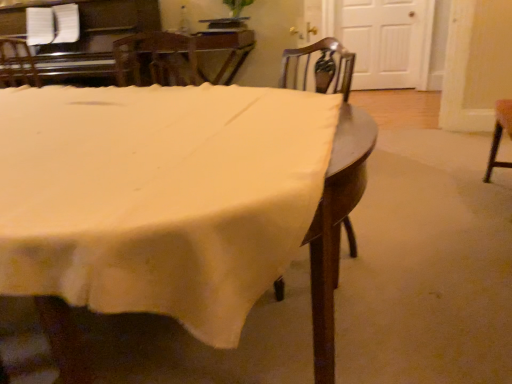
Where is `wooden at center`? wooden at center is located at coordinates (320, 65).

Describe the element at coordinates (320, 65) in the screenshot. I see `wooden at center` at that location.

Measure the distance between point (281, 294) and camera.

A distance of 1.61 meters exists between point (281, 294) and camera.

Describe the element at coordinates (178, 203) in the screenshot. I see `white fabric table at center` at that location.

In order to click on white fabric table at center in this screenshot , I will do coord(178,203).

The image size is (512, 384). I want to click on wooden at center, so click(320, 65).

Which is more to the left, wooden at center or white fabric table at center?

white fabric table at center.

Which is behind, wooden at center or white fabric table at center?

wooden at center is further away from the camera.

Does point (303, 89) come in front of point (44, 133)?

No, it is behind (44, 133).

From the image's perspective, which one is positioned higher, wooden at center or white fabric table at center?

From the image's view, wooden at center is above.

From a real-world perspective, is wooden at center physically located above or below white fabric table at center?

wooden at center is above white fabric table at center.

Considering the relative sizes of wooden at center and white fabric table at center in the image provided, is wooden at center wider than white fabric table at center?

No.

From the picture: Which of these two, wooden at center or white fabric table at center, stands shorter?

white fabric table at center is shorter.

Can you confirm if wooden at center is bigger than white fabric table at center?

Incorrect, wooden at center is not larger than white fabric table at center.

From the picture: Can white fabric table at center be found inside wooden at center?

No.

Is wooden at center next to white fabric table at center and touching it?

No.

Is wooden at center facing away from white fabric table at center?

Yes, wooden at center is facing away from white fabric table at center.

Consider the image. What's the angular difference between wooden at center and white fabric table at center's facing directions?

They differ by 37.8 degrees in their facing directions.

How much distance is there between wooden at center and white fabric table at center?

wooden at center and white fabric table at center are 25.96 inches apart from each other.

Find the location of a particular element. The height and width of the screenshot is (384, 512). table in front of the wooden at center is located at coordinates coord(178,203).

Considering the relative positions of white fabric table at center and wooden at center in the image provided, is white fabric table at center to the left of wooden at center from the viewer's perspective?

Indeed, white fabric table at center is positioned on the left side of wooden at center.

Who is more distant, white fabric table at center or wooden at center?

wooden at center is further away from the camera.

Is point (154, 132) more distant than point (328, 56)?

No, it is in front of (328, 56).

From the image's perspective, is white fabric table at center over wooden at center?

Incorrect, from the image's perspective, white fabric table at center is lower than wooden at center.

From a real-world perspective, is white fabric table at center physically below wooden at center?

Yes.

In the scene shown: Considering the relative sizes of white fabric table at center and wooden at center in the image provided, is white fabric table at center wider than wooden at center?

Correct, the width of white fabric table at center exceeds that of wooden at center.

Consider the image. Considering the relative sizes of white fabric table at center and wooden at center in the image provided, is white fabric table at center shorter than wooden at center?

Correct, white fabric table at center is not as tall as wooden at center.

Is white fabric table at center smaller than wooden at center?

Incorrect, white fabric table at center is not smaller in size than wooden at center.

Is wooden at center a part of white fabric table at center?

That's correct, wooden at center is inside white fabric table at center.

Is there a large distance between white fabric table at center and wooden at center?

Actually, white fabric table at center and wooden at center are a little close together.

Could you tell me if white fabric table at center is turned towards wooden at center?

No, white fabric table at center is not turned towards wooden at center.

How many degrees apart are the facing directions of white fabric table at center and wooden at center?

They differ by 37.8 degrees in their facing directions.

This screenshot has height=384, width=512. I want to click on chair on the right side of white fabric table at center, so click(x=320, y=65).

Find the location of `chair lying above the white fabric table at center (from the image's perspective)`. chair lying above the white fabric table at center (from the image's perspective) is located at coordinates (320, 65).

You are a GUI agent. You are given a task and a screenshot of the screen. Output one action in this format:
    pyautogui.click(x=<x>, y=<y>)
    Task: Click on the chair above the white fabric table at center (from a real-world perspective)
    This screenshot has height=384, width=512.
    Given the screenshot: What is the action you would take?
    pyautogui.click(x=320, y=65)